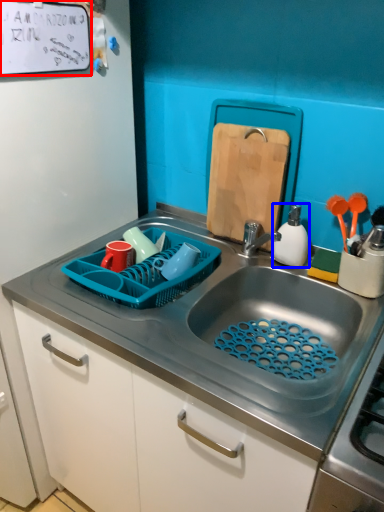
Question: Which object appears farthest to the camera in this image, bulletin board (highlighted by a red box) or appliance (highlighted by a blue box)?

Choices:
 (A) bulletin board
 (B) appliance

Answer: (B)